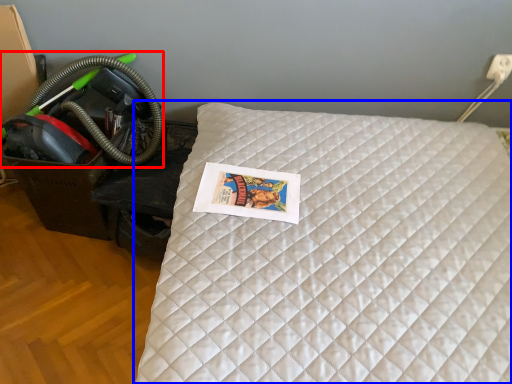
Question: Which point is closer to the camera, garden hose (highlighted by a red box) or bed (highlighted by a blue box)?

Choices:
 (A) garden hose
 (B) bed

Answer: (B)